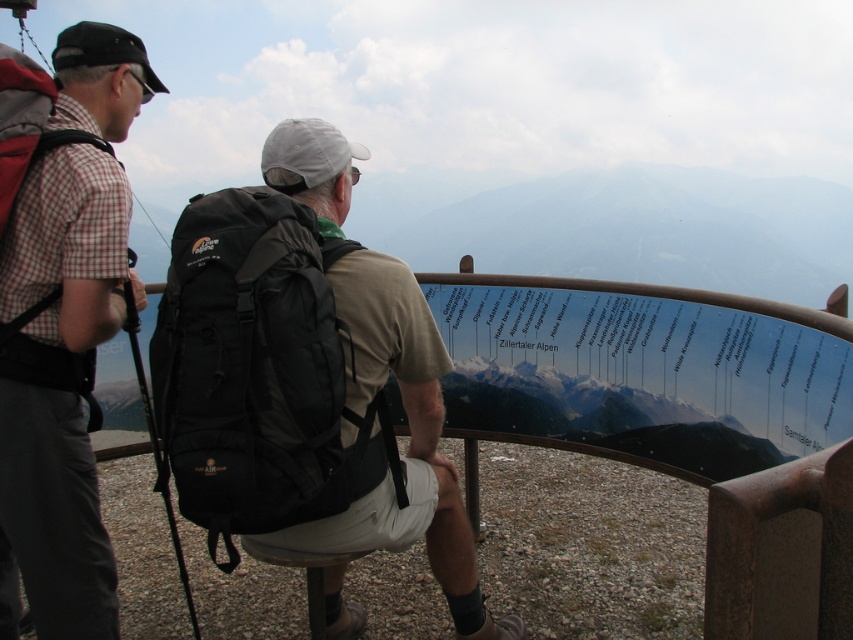
Question: Does matte plaid shirt at left have a smaller size compared to matte black backpack at center?

Choices:
 (A) yes
 (B) no

Answer: (A)

Question: Which object is closer to the camera taking this photo?

Choices:
 (A) matte black backpack at center
 (B) matte plaid shirt at left

Answer: (A)

Question: Estimate the real-world distances between objects in this image. Which object is farther from the matte plaid shirt at left?

Choices:
 (A) black fabric backpack at center
 (B) matte black backpack at center

Answer: (B)

Question: Among these objects, which one is farthest from the camera?

Choices:
 (A) matte plaid shirt at left
 (B) black fabric backpack at center

Answer: (A)

Question: Can you confirm if black fabric backpack at center is positioned to the left of matte black backpack at center?

Choices:
 (A) no
 (B) yes

Answer: (B)

Question: Is matte plaid shirt at left to the right of matte black backpack at center from the viewer's perspective?

Choices:
 (A) no
 (B) yes

Answer: (A)